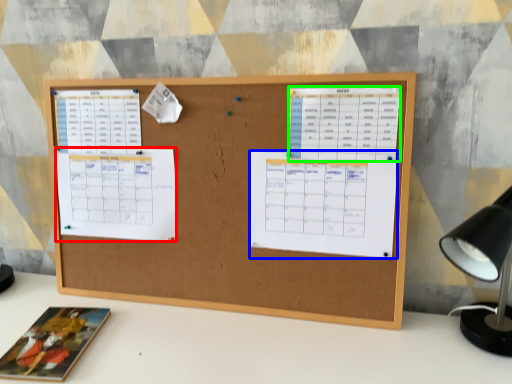
Question: Which object is positioned farthest from list (highlighted by a red box)? Select from list (highlighted by a blue box) and list (highlighted by a green box).

Choices:
 (A) list
 (B) list

Answer: (B)